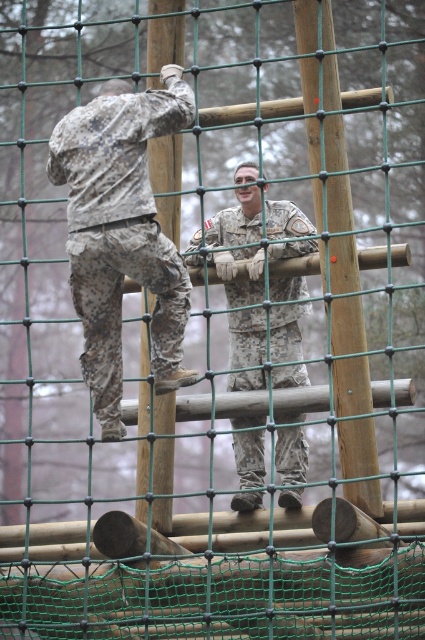
You are a military instructor observing the obstacle course. You notice the camouflage fabric soldier at upper left and the camouflage fabric pole at left. Which object is taller?

The camouflage fabric pole at left is taller than the camouflage fabric soldier at upper left.

Based on the scene described, can you determine the position of the camouflage fabric soldier at upper left relative to the camouflage fabric pole at left?

The camouflage fabric soldier at upper left is positioned to the left of the camouflage fabric pole at left.